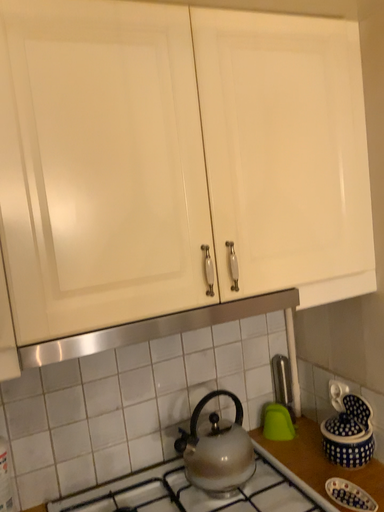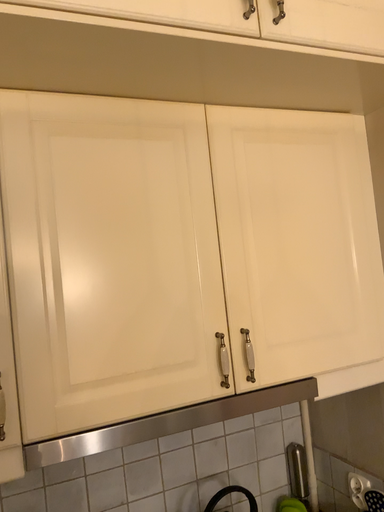
Question: Which way did the camera rotate in the video?

Choices:
 (A) rotated downward
 (B) rotated upward

Answer: (B)